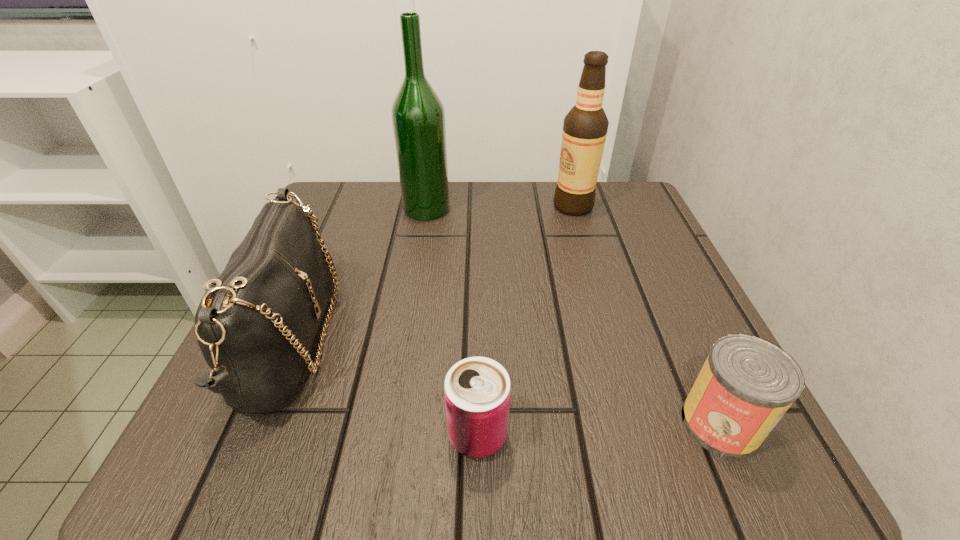
This screenshot has width=960, height=540. Find the location of `vacant space that's between the right alcohol and the right can`. vacant space that's between the right alcohol and the right can is located at coordinates (647, 315).

Find the location of a particular element. The width and height of the screenshot is (960, 540). free space between the left can and the right can is located at coordinates (599, 429).

At what (x,y) coordinates should I click in order to perform the action: click on vacant point located between the taller alcohol and the third object from right to left. Please return your answer as a coordinate pair (x, y). This screenshot has height=540, width=960. Looking at the image, I should click on (452, 322).

Locate an element on the screen. unoccupied area between the rightmost object and the left alcohol is located at coordinates (573, 316).

Where is `free space between the third tallest object and the left can`? The width and height of the screenshot is (960, 540). free space between the third tallest object and the left can is located at coordinates (383, 388).

Find the location of a particular element. Image resolution: width=960 pixels, height=540 pixels. empty location between the rightmost object and the left can is located at coordinates (599, 429).

Image resolution: width=960 pixels, height=540 pixels. In order to click on blank region between the leftmost object and the second tallest object in this screenshot , I will do `click(430, 274)`.

I want to click on vacant area between the taller alcohol and the left can, so click(x=452, y=322).

Where is `empty location between the right can and the left alcohol`? empty location between the right can and the left alcohol is located at coordinates (573, 316).

The image size is (960, 540). In order to click on object that can be found as the third closest to the second object from left to right in this screenshot , I will do `click(477, 390)`.